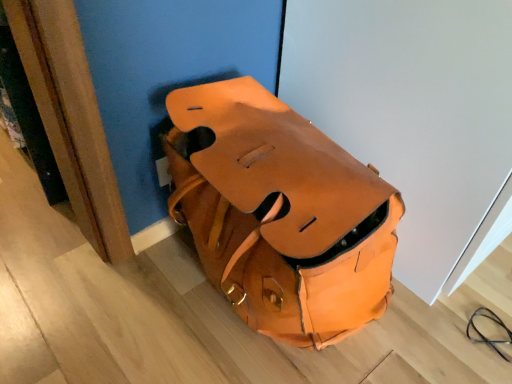
Image resolution: width=512 pixels, height=384 pixels. I want to click on leather bag at center, so coord(281,214).

This screenshot has width=512, height=384. What do you see at coordinates (281, 214) in the screenshot?
I see `leather bag at center` at bounding box center [281, 214].

Find the location of a particular element. This screenshot has width=512, height=384. leather bag at center is located at coordinates (281, 214).